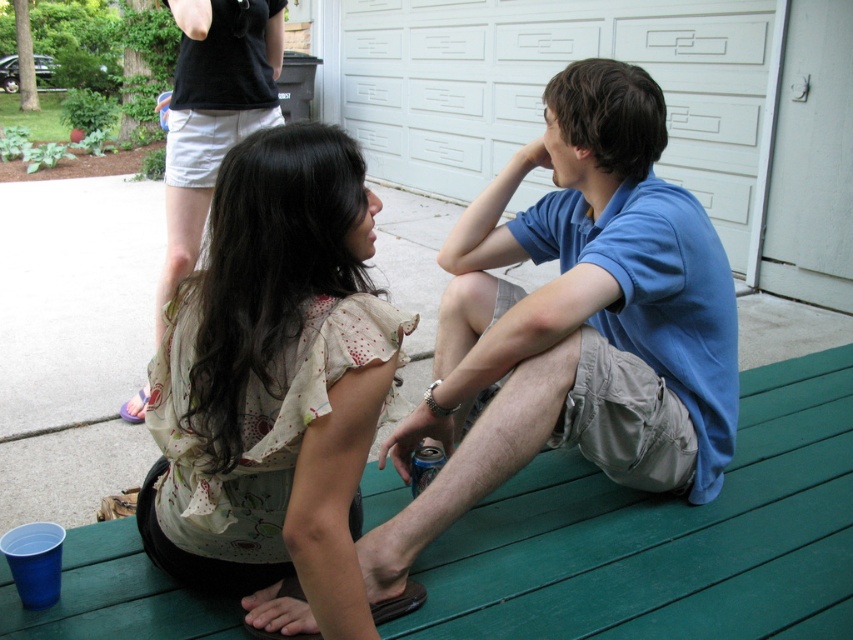
Question: Is blue cotton shirt at center wider than floral cotton blouse at center?

Choices:
 (A) no
 (B) yes

Answer: (B)

Question: Which of the following is the closest to the observer?

Choices:
 (A) (540, 204)
 (B) (369, 150)
 (C) (274, 374)

Answer: (C)

Question: Which object is farther from the camera taking this photo?

Choices:
 (A) floral cotton blouse at center
 (B) white textured garage door at upper center
 (C) blue cotton shirt at center

Answer: (B)

Question: Which point appears farthest from the camera in this image?

Choices:
 (A) (506, 150)
 (B) (625, 474)
 (C) (263, 561)

Answer: (A)

Question: Is blue cotton shirt at center wider than white textured garage door at upper center?

Choices:
 (A) yes
 (B) no

Answer: (B)

Question: Can you confirm if blue cotton shirt at center is positioned below white textured garage door at upper center?

Choices:
 (A) no
 (B) yes

Answer: (B)